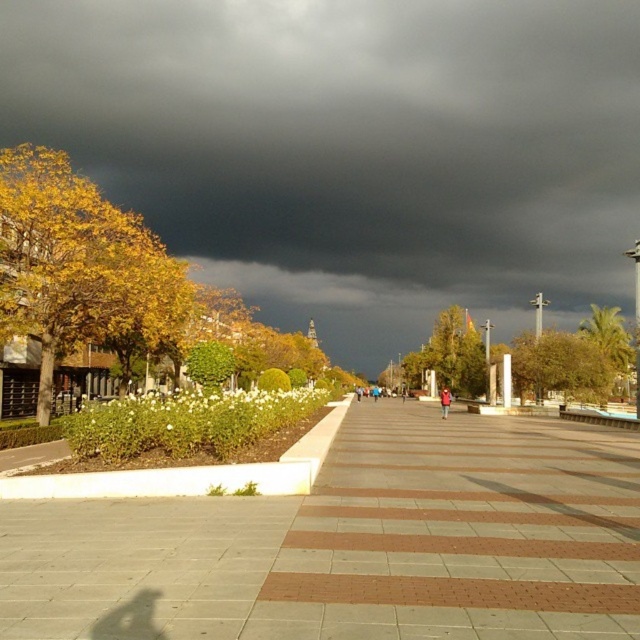
You are standing in the plaza and want to take a photo of the dark gray cloud at upper center and the brown tiled pavement at center. Which object should you focus on first to ensure both are in sharp focus?

You should focus on the dark gray cloud at upper center first because it is closer to you than the brown tiled pavement at center, so focusing on the closer object will help keep both in focus.

You are an architect designing a new plaza and want to ensure the brown tiled pavement at center is visible from a distance. Considering the dark gray cloud at upper center, which object is wider and might obscure the view of the pavement?

The dark gray cloud at upper center is wider than the brown tiled pavement at center, so it might obscure the view of the pavement.

You are standing in the plaza and looking up at the sky. Which object, the dark gray cloud at upper center or the brown tiled pavement at center, is located to the left when viewed from your perspective?

The dark gray cloud at upper center is located to the left of the brown tiled pavement at center.